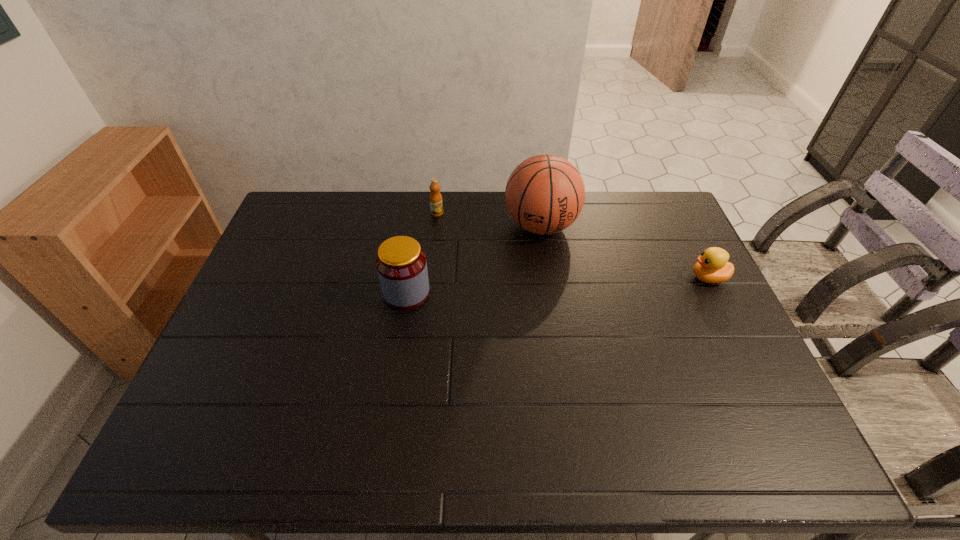
Find the location of a particular element. Image resolution: width=960 pixels, height=540 pixels. free spot on the desktop that is between the jar and the rightmost object and is positioned on the surface of the third object from left to right near the brand logo is located at coordinates (552, 286).

Locate an element on the screen. vacant spot on the desktop that is between the second tallest object and the shortest object and is positioned on the front label of the orange juice is located at coordinates (520, 287).